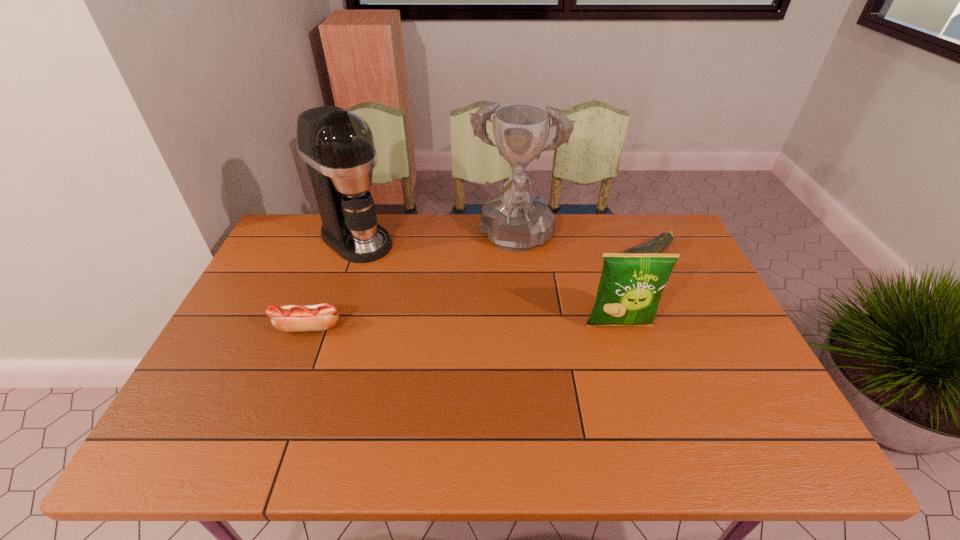
Find the location of a particular element. coffee maker that is at the left edge is located at coordinates 337,145.

Image resolution: width=960 pixels, height=540 pixels. Find the location of `object at the right edge`. object at the right edge is located at coordinates (657, 245).

Image resolution: width=960 pixels, height=540 pixels. Identify the location of object situated at the far left corner. (337, 145).

In order to click on object that is at the far right corner in this screenshot , I will do `click(657, 245)`.

At what (x,y) coordinates should I click in order to perform the action: click on vacant space at the far edge of the desktop. Please return your answer as a coordinate pair (x, y). This screenshot has width=960, height=540. Looking at the image, I should click on (479, 233).

At what (x,y) coordinates should I click in order to perform the action: click on vacant area at the near edge. Please return your answer as a coordinate pair (x, y). Looking at the image, I should click on (632, 397).

In the image, there is a desktop. Identify the location of vacant area at the left edge. (227, 373).

Identify the location of free space at the right edge of the desktop. (728, 364).

Where is `blank area at the far left corner`? This screenshot has height=540, width=960. blank area at the far left corner is located at coordinates (301, 238).

Locate an element on the screen. free location at the near left corner of the desktop is located at coordinates (250, 390).